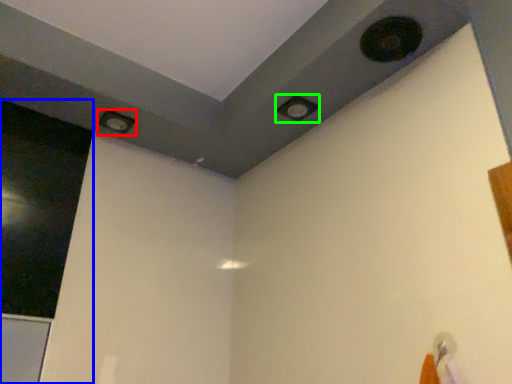
Question: Based on their relative distances, which object is nearer to hole (highlighted by a red box)? Choose from screen door (highlighted by a blue box) and hole (highlighted by a green box).

Choices:
 (A) screen door
 (B) hole

Answer: (A)